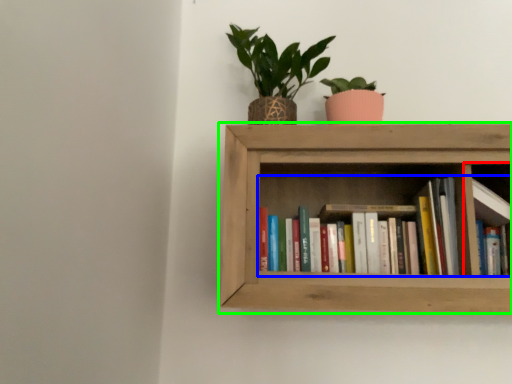
Question: Which is farther away from cabinet (highlighted by a red box)? book (highlighted by a blue box) or shelf (highlighted by a green box)?

Choices:
 (A) book
 (B) shelf

Answer: (B)